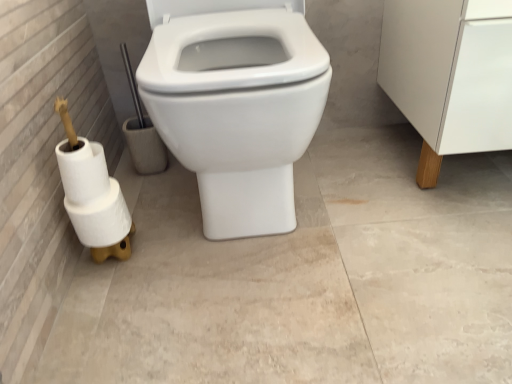
Question: Is white matte toilet paper at left, which is the 2th toilet paper from top to bottom, to the left or to the right of white wood cabinet leg at right in the image?

Choices:
 (A) right
 (B) left

Answer: (B)

Question: Is white matte toilet paper at left, which ranks as the second toilet paper in bottom-to-top order, wider or thinner than white wood cabinet leg at right?

Choices:
 (A) wide
 (B) thin

Answer: (B)

Question: Estimate the real-world distances between objects in this image. Which object is farther from the white matte toilet paper at left, which is the 2th toilet paper from top to bottom?

Choices:
 (A) white matte toilet paper at lower left, the third toilet paper from the top
 (B) white wood cabinet leg at right
 (C) white matte toilet paper at lower left, placed as the first toilet paper when sorted from top to bottom
 (D) white glossy toilet at center

Answer: (B)

Question: Which of these objects is positioned farthest from the white glossy toilet at center?

Choices:
 (A) white wood cabinet leg at right
 (B) white matte toilet paper at left, which ranks as the second toilet paper in bottom-to-top order
 (C) white matte toilet paper at lower left, placed as the first toilet paper when sorted from top to bottom
 (D) white matte toilet paper at lower left, the third toilet paper from the top

Answer: (A)